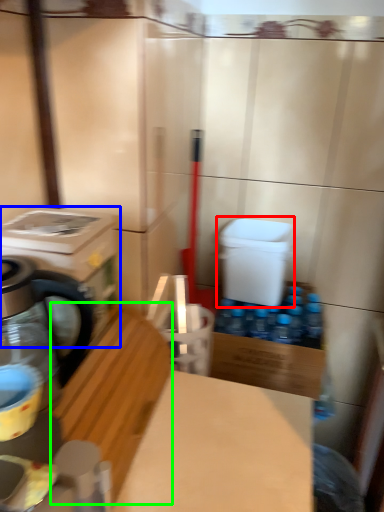
Question: Considering the real-world distances, which object is closest to water cooler (highlighted by a red box)? washing machine (highlighted by a blue box) or wood (highlighted by a green box).

Choices:
 (A) washing machine
 (B) wood

Answer: (B)